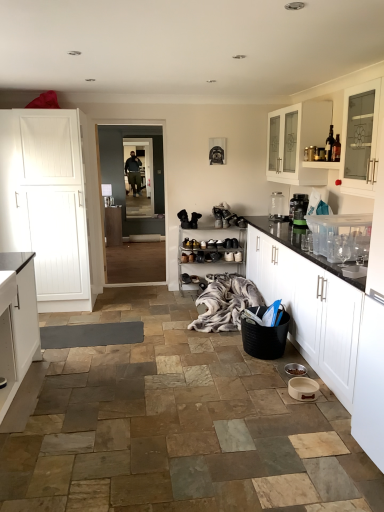
Describe the element at coordinates (265, 339) in the screenshot. The width and height of the screenshot is (384, 512). I see `black plastic basket at lower right` at that location.

In order to face dark brown glass bottle at upper right, should I rotate leftwards or rightwards?

You should look right and rotate roughly 18.599 degrees.

This screenshot has width=384, height=512. Find the location of `transparent glass door at center`. transparent glass door at center is located at coordinates (141, 177).

This screenshot has height=512, width=384. What are the coordinates of `black plastic basket at lower right` in the screenshot? It's located at (265, 339).

Between point (181, 275) and point (250, 335), which one is positioned behind?

The point (181, 275) is farther from the camera.

How different are the orientations of leather shoe at center and black plastic basket at lower right in degrees?

leather shoe at center and black plastic basket at lower right are facing 90 degrees away from each other.

From the image's perspective, relative to black plastic basket at lower right, is leather shoe at center above or below?

Based on their image positions, leather shoe at center is located above black plastic basket at lower right.

Is black plastic basket at lower right at the back of leather shoe at center?

That's not correct — leather shoe at center is not looking away from black plastic basket at lower right.

Considering the relative sizes of metallic silver shoe rack at center and white wood door at left, the fourth cabinetry when ordered from front to back, in the image provided, is metallic silver shoe rack at center bigger than white wood door at left, the fourth cabinetry when ordered from front to back,?

Incorrect, metallic silver shoe rack at center is not larger than white wood door at left, the fourth cabinetry when ordered from front to back.

Is metallic silver shoe rack at center positioned with its back to white wood door at left, the 3th cabinetry positioned from the back?

No, metallic silver shoe rack at center's orientation is not away from white wood door at left, the 3th cabinetry positioned from the back.

Does metallic silver shoe rack at center have a lesser height compared to white wood door at left, the 3th cabinetry positioned from the back?

Indeed, metallic silver shoe rack at center has a lesser height compared to white wood door at left, the 3th cabinetry positioned from the back.

Is metallic silver shoe rack at center next to white wood door at left, the 3th cabinetry positioned from the back?

metallic silver shoe rack at center and white wood door at left, the 3th cabinetry positioned from the back, are not in contact.

Locate an element on the screen. appliance that appears below the white glass cabinet at upper right, the 5th cabinetry in the front-to-back sequence (from a real-world perspective) is located at coordinates (277, 207).

Could you tell me if white glass cabinet at upper right, which is the 2th cabinetry from back to front, is facing transparent glass water bottle at upper right?

No, white glass cabinet at upper right, which is the 2th cabinetry from back to front, does not turn towards transparent glass water bottle at upper right.

Which object is more forward, white glass cabinet at upper right, which is the 2th cabinetry from back to front, or transparent glass water bottle at upper right?

white glass cabinet at upper right, which is the 2th cabinetry from back to front, is in front.

From the image's perspective, would you say white glass cabinet at upper right, the 5th cabinetry in the front-to-back sequence, is positioned over transparent glass water bottle at upper right?

Yes.

Considering the sizes of objects black plastic coffee machine at right and white glass cabinet at upper right, placed as the fifth cabinetry when sorted from left to right, in the image provided, who is shorter, black plastic coffee machine at right or white glass cabinet at upper right, placed as the fifth cabinetry when sorted from left to right,?

With less height is black plastic coffee machine at right.

Can you confirm if black plastic coffee machine at right is smaller than white glass cabinet at upper right, the 5th cabinetry in the front-to-back sequence?

Indeed, black plastic coffee machine at right has a smaller size compared to white glass cabinet at upper right, the 5th cabinetry in the front-to-back sequence.

From a real-world perspective, is black plastic coffee machine at right on white glass cabinet at upper right, placed as the fifth cabinetry when sorted from left to right?

No, from a real-world perspective, black plastic coffee machine at right is not on top of white glass cabinet at upper right, placed as the fifth cabinetry when sorted from left to right.

Is black plastic coffee machine at right facing away from white glass cabinet at upper right, the 5th cabinetry in the front-to-back sequence?

No, white glass cabinet at upper right, the 5th cabinetry in the front-to-back sequence, is not at the back of black plastic coffee machine at right.

From the image's perspective, who appears lower, clear glass cabinet at upper right, which appears as the third cabinetry when viewed from the front, or leather shoe at center?

Result: leather shoe at center is shown below in the image.

Is clear glass cabinet at upper right, which appears as the third cabinetry when viewed from the front, far away from leather shoe at center?

Absolutely, clear glass cabinet at upper right, which appears as the third cabinetry when viewed from the front, is distant from leather shoe at center.

In the image, is clear glass cabinet at upper right, the 6th cabinetry positioned from the left, positioned in front of or behind leather shoe at center?

In the image, clear glass cabinet at upper right, the 6th cabinetry positioned from the left, appears in front of leather shoe at center.

Between transparent glass door at center and white matte cabinet at lower left, the sixth cabinetry in the back-to-front sequence, which one has more height?

With more height is transparent glass door at center.

Considering the sizes of objects transparent glass door at center and white matte cabinet at lower left, acting as the 1th cabinetry starting from the front, in the image provided, who is thinner, transparent glass door at center or white matte cabinet at lower left, acting as the 1th cabinetry starting from the front,?

With smaller width is transparent glass door at center.

How different are the orientations of transparent glass door at center and white matte cabinet at lower left, acting as the 1th cabinetry starting from the front, in degrees?

transparent glass door at center and white matte cabinet at lower left, acting as the 1th cabinetry starting from the front, are facing 91.5 degrees away from each other.

How distant is transparent glass door at center from white matte cabinet at lower left, acting as the 1th cabinetry starting from the front?

transparent glass door at center is 10.78 feet away from white matte cabinet at lower left, acting as the 1th cabinetry starting from the front.

Between white wood door at left, the 3th cabinetry positioned from the back, and gray woolen blanket at lower center, which one appears on the right side from the viewer's perspective?

gray woolen blanket at lower center is more to the right.

Is white wood door at left, the fourth cabinetry when ordered from front to back, closer to the viewer compared to gray woolen blanket at lower center?

That is False.

Does white wood door at left, acting as the 6th cabinetry starting from the right, have a larger size compared to gray woolen blanket at lower center?

Yes, white wood door at left, acting as the 6th cabinetry starting from the right, is bigger than gray woolen blanket at lower center.

This screenshot has width=384, height=512. What are the coordinates of `footwear lying on the left of black plastic basket at lower right` in the screenshot? It's located at (186, 278).

Identify the location of the 1st cabinetry above when counting from the metallic silver shoe rack at center (from the image's perspective). Image resolution: width=384 pixels, height=512 pixels. (50, 204).

Based on their spatial positions, is metallic silver shoe rack at center or clear glass cabinet at upper right, the fourth cabinetry in the back-to-front sequence, closer to white glass cabinet at upper right, the 5th cabinetry in the front-to-back sequence?

Among the two, clear glass cabinet at upper right, the fourth cabinetry in the back-to-front sequence, is located nearer to white glass cabinet at upper right, the 5th cabinetry in the front-to-back sequence.

Which object lies nearer to the anchor point gray woolen blanket at lower center, transparent glass water bottle at upper right or white wood door at left, which is the first cabinetry from left to right?

transparent glass water bottle at upper right lies closer to gray woolen blanket at lower center than the other object.

Which object lies further to the anchor point leather shoe at center, transparent glass water bottle at upper right or dark brown glass bottle at upper right?

The object further to leather shoe at center is dark brown glass bottle at upper right.

When comparing their distances from black plastic basket at lower right, does metallic silver shoe rack at center or white matte cabinet at lower right, which appears as the 3th cabinetry when viewed from the right, seem further?

metallic silver shoe rack at center is further to black plastic basket at lower right.

Which object lies further to the anchor point gray woolen blanket at lower center, white glass cabinet at upper right, the 2th cabinetry when ordered from right to left, or white matte cabinet at lower right, which appears as the 3th cabinetry when viewed from the right?

white glass cabinet at upper right, the 2th cabinetry when ordered from right to left.

When comparing their distances from white wood door at left, acting as the 6th cabinetry starting from the right, does clear glass cabinet at upper right, which appears as the third cabinetry when viewed from the front, or transparent glass door at center seem further?

clear glass cabinet at upper right, which appears as the third cabinetry when viewed from the front.

Which object lies further to the anchor point white wood cabinet at center, arranged as the 2th cabinetry when viewed from the left, white matte cabinet at lower left, the 4th cabinetry viewed from the right, or dark brown glass bottle at upper right?

Based on the image, dark brown glass bottle at upper right appears to be further to white wood cabinet at center, arranged as the 2th cabinetry when viewed from the left.

When comparing their distances from metallic silver shoe rack at center, does transparent glass door at center or white matte cabinet at lower left, acting as the third cabinetry starting from the left, seem closer?

transparent glass door at center is positioned closer to the anchor metallic silver shoe rack at center.

Where is `bottle positioned between white matte cabinet at lower right, which is counted as the fourth cabinetry, starting from the left, and metallic silver shoe rack at center from near to far`? bottle positioned between white matte cabinet at lower right, which is counted as the fourth cabinetry, starting from the left, and metallic silver shoe rack at center from near to far is located at coordinates (329, 145).

What are the coordinates of `appliance between dark brown glass bottle at upper right and transparent glass door at center along the z-axis` in the screenshot? It's located at (277, 207).

What are the coordinates of `appliance between white glass cabinet at upper right, the 2th cabinetry when ordered from right to left, and metallic silver shoe rack at center in the up-down direction` in the screenshot? It's located at (277, 207).

I want to click on coffee machine that lies between dark brown glass bottle at upper right and gray woolen blanket at lower center from top to bottom, so click(x=298, y=209).